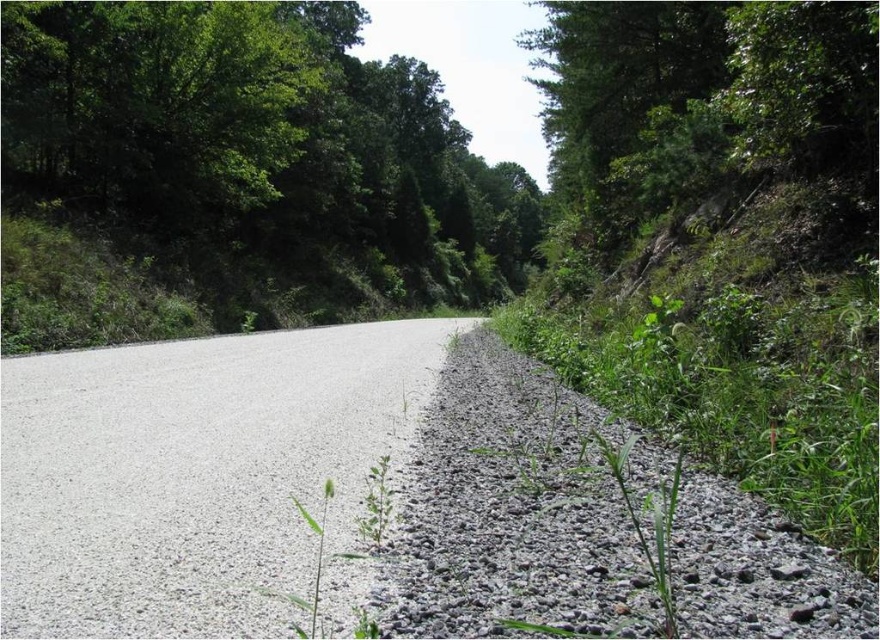
You are a gardener who needs to determine the best path to walk on without damaging the plants. Based on the scene, which area is wider and more suitable for walking between the gray gravel at right and the green grassy weed at center?

The gray gravel at right has a larger width than the green grassy weed at center, making it more suitable for walking without damaging the plants.

You are driving a delivery truck that requires a minimum of 10 meters of clear road space to safely navigate a sharp turn. Given the gray asphalt road at center and the green matte plant at center, can you determine if there is enough space for your truck to make the turn safely?

The gray asphalt road at center is bigger than the green matte plant at center, but the exact dimensions of the road are not provided. Without knowing the actual width of the road, it is impossible to determine if there is sufficient space for the truck to navigate the turn safely.

You are a delivery driver navigating a rural route and need to make a turn onto a narrower side road. You see the gray asphalt road at center and the green matte plant at center in your view. Which path is wider and safer for your vehicle?

The gray asphalt road at center is wider than the green matte plant at center, so it is the safer path for your vehicle.